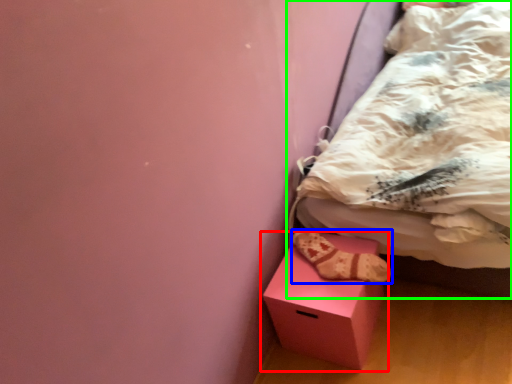
Question: Based on their relative distances, which object is nearer to box (highlighted by a red box)? Choose from footwear (highlighted by a blue box) and bed (highlighted by a green box).

Choices:
 (A) footwear
 (B) bed

Answer: (A)